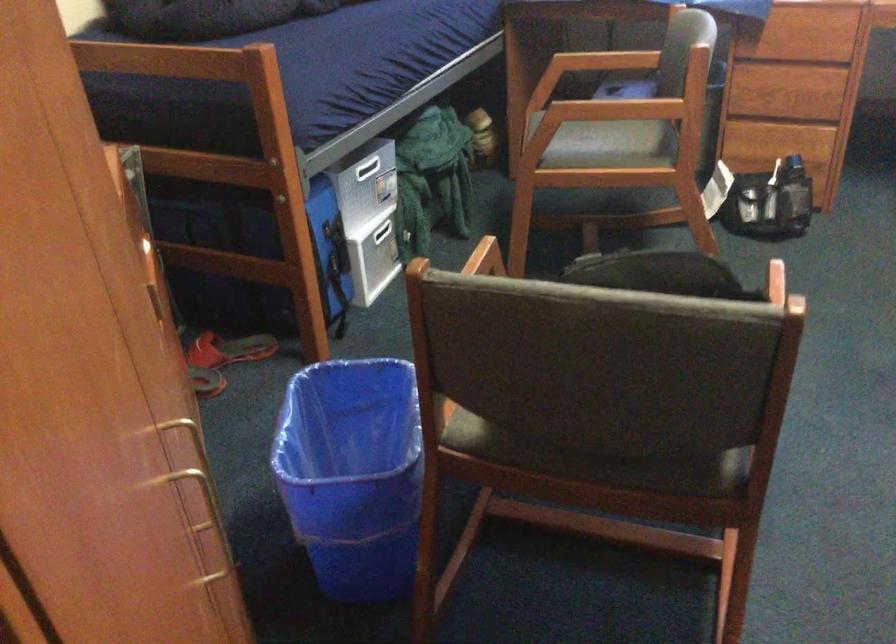
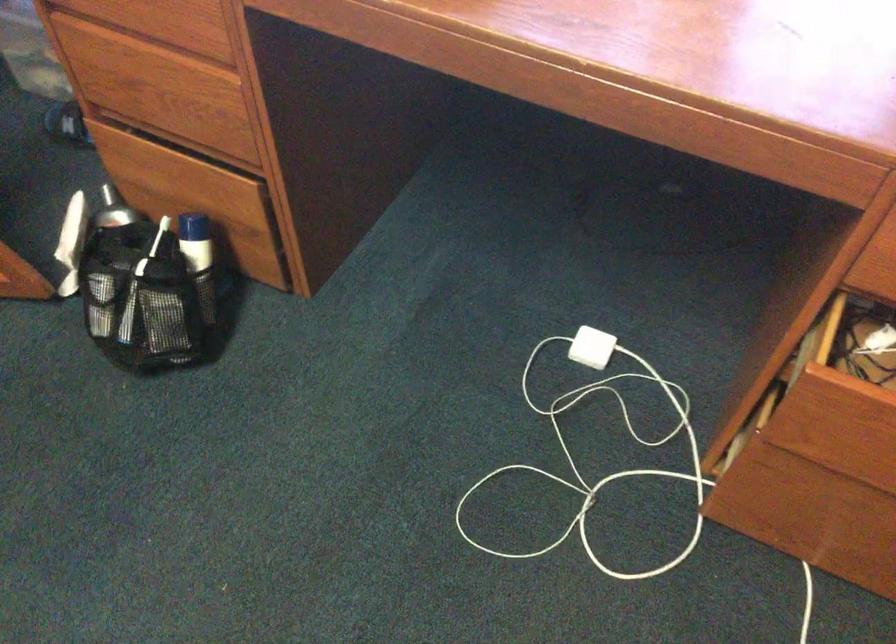
From the picture: Which direction would the cameraman need to move to produce the second image?

The movement direction of the cameraman is right, forward.